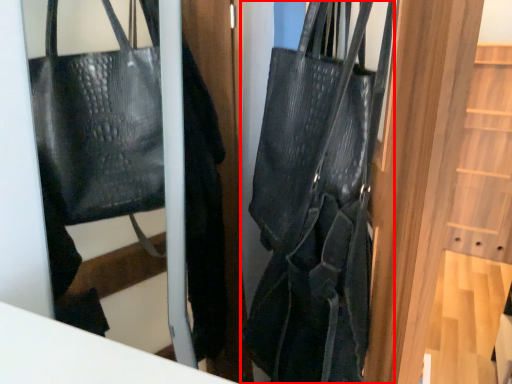
Question: From the image, what is the correct spatial relationship of handbag (annotated by the red box) in relation to door?

Choices:
 (A) right
 (B) left

Answer: (A)